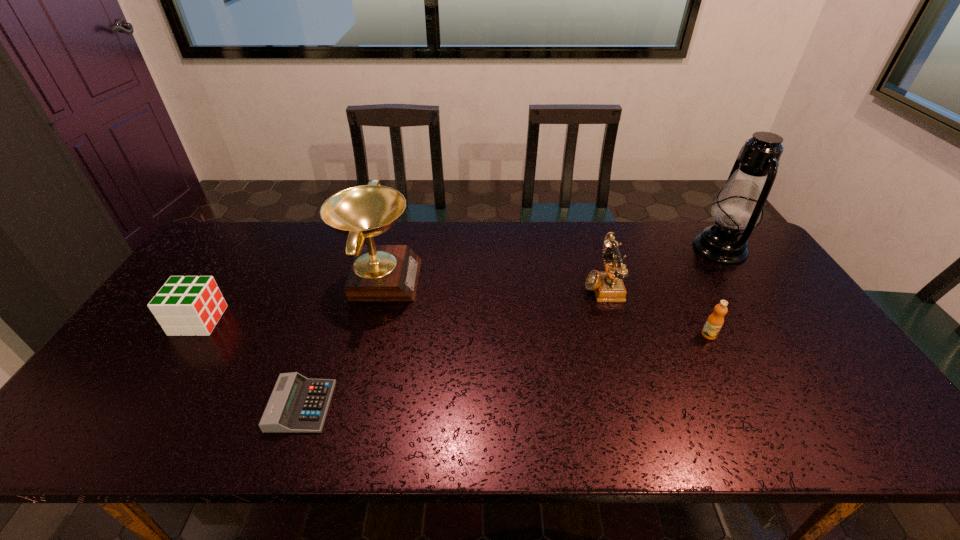
What are the coordinates of `object located at the near edge` in the screenshot? It's located at (297, 404).

Locate an element on the screen. This screenshot has height=540, width=960. object at the left edge is located at coordinates (192, 305).

The image size is (960, 540). Find the location of `object that is at the right edge`. object that is at the right edge is located at coordinates (739, 204).

The image size is (960, 540). I want to click on object that is at the far right corner, so click(739, 204).

Locate an element on the screen. vacant space at the far edge of the desktop is located at coordinates (477, 260).

The width and height of the screenshot is (960, 540). Identify the location of vacant space at the near edge. (243, 436).

This screenshot has height=540, width=960. In order to click on free space at the left edge in this screenshot , I will do `click(239, 267)`.

Find the location of a particular element. vacant point at the far left corner is located at coordinates (237, 224).

Identify the location of empty space between the leftmost object and the shortest object. (250, 363).

You are a GUI agent. You are given a task and a screenshot of the screen. Output one action in this format:
    pyautogui.click(x=<x>, y=<y>)
    Task: Click on the free area in between the orange juice and the leftmost object
    This screenshot has height=540, width=960.
    Given the screenshot: What is the action you would take?
    pyautogui.click(x=454, y=328)